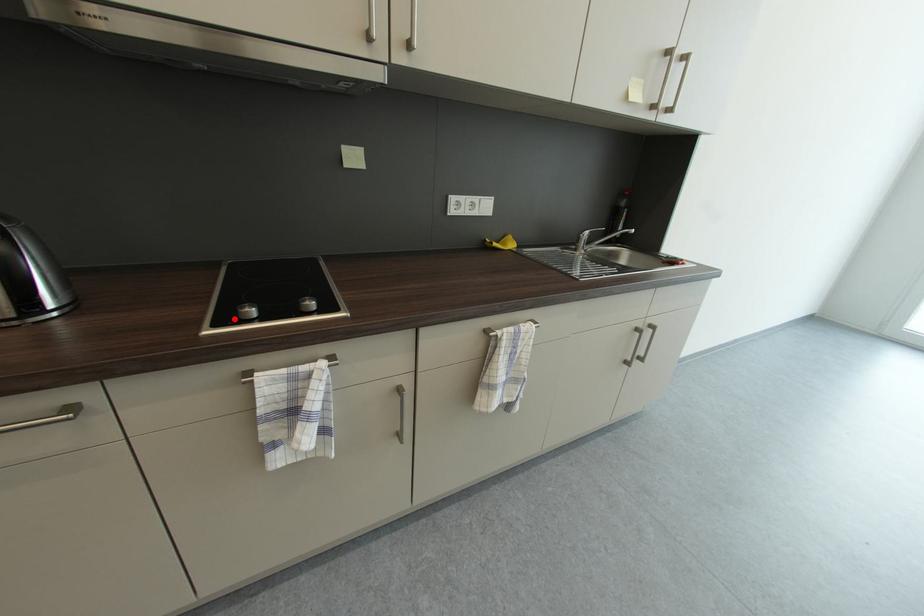
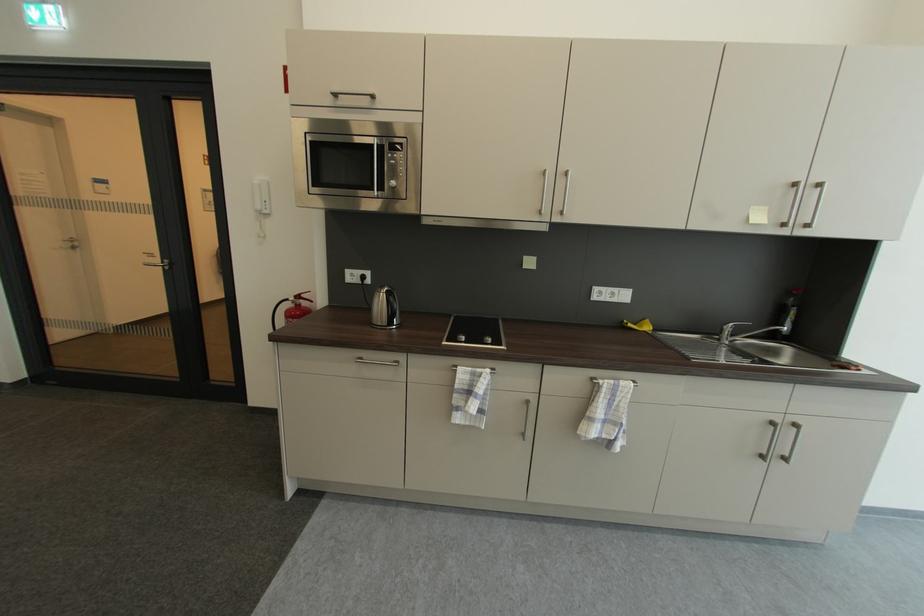
Locate, in the second image, the point that corresponds to the highlighted location in the first image.

(458, 341)